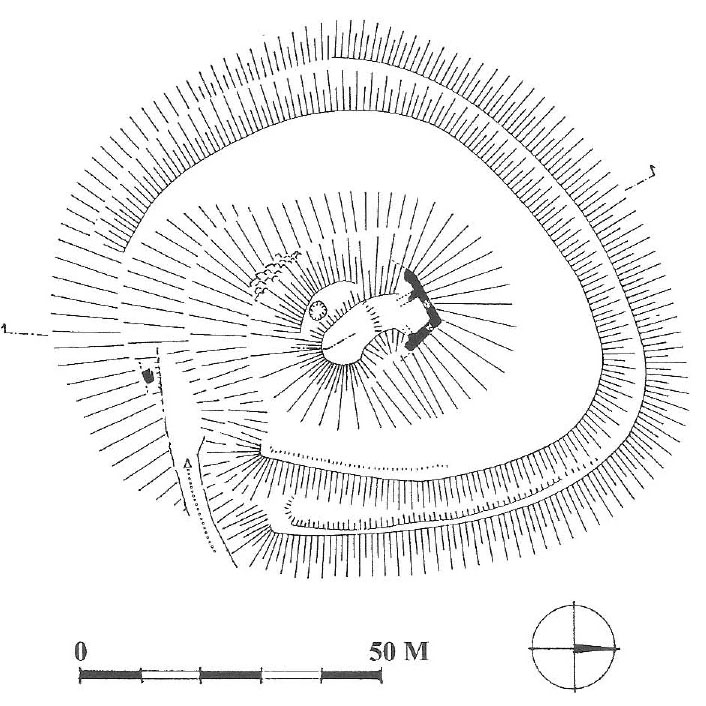
This screenshot has height=706, width=706. Identify the location of bar. (219, 673).